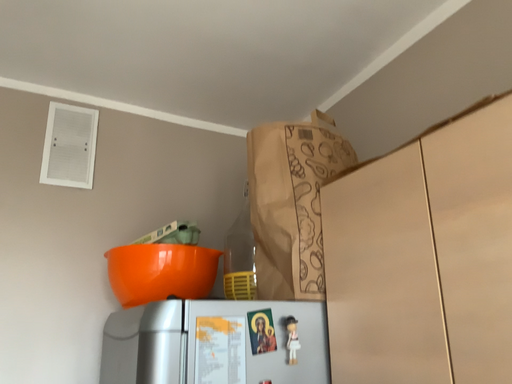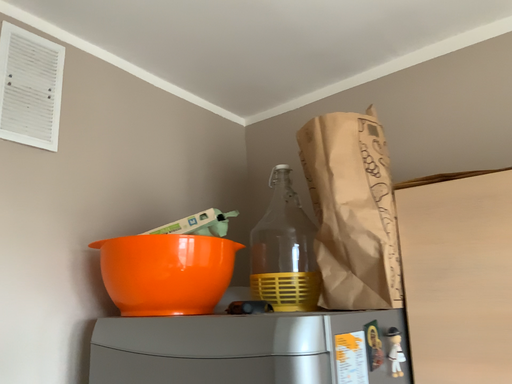
Question: Which way did the camera rotate in the video?

Choices:
 (A) rotated left
 (B) rotated right

Answer: (B)